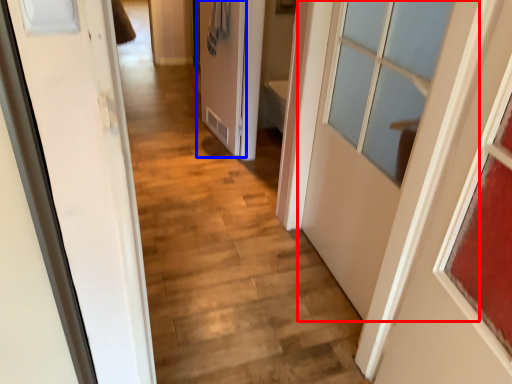
Question: Among these objects, which one is nearest to the camera, door (highlighted by a red box) or door (highlighted by a blue box)?

Choices:
 (A) door
 (B) door

Answer: (A)